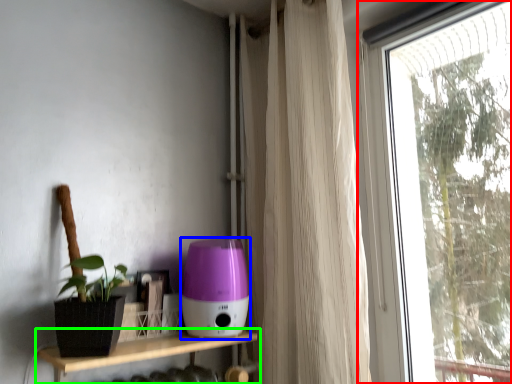
Question: Which is farther away from window (highlighted by a red box)? appliance (highlighted by a blue box) or shelf (highlighted by a green box)?

Choices:
 (A) appliance
 (B) shelf

Answer: (B)